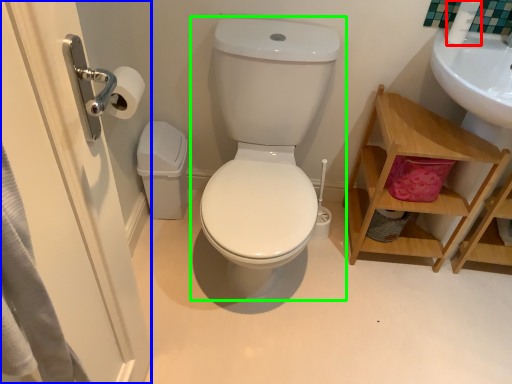
Question: Estimate the real-world distances between objects in this image. Which object is farther from toiletry (highlighted by a red box), screen door (highlighted by a blue box) or toilet (highlighted by a green box)?

Choices:
 (A) screen door
 (B) toilet

Answer: (A)